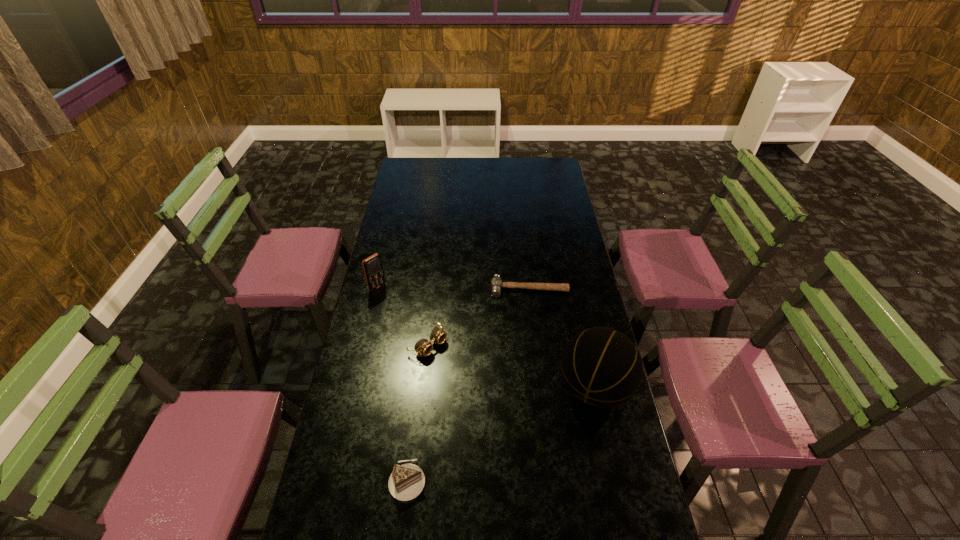
Where is `empty location between the shortest object and the cellular telephone`? The width and height of the screenshot is (960, 540). empty location between the shortest object and the cellular telephone is located at coordinates (453, 288).

Where is `vacant point located between the goggles and the hammer`? This screenshot has height=540, width=960. vacant point located between the goggles and the hammer is located at coordinates (479, 316).

This screenshot has height=540, width=960. Identify the location of free area in between the chocolate cake and the cellular telephone. (393, 384).

At what (x,y) coordinates should I click in order to perform the action: click on unoccupied position between the fourth shortest object and the tallest object. Please return your answer as a coordinate pair (x, y). This screenshot has height=540, width=960. Looking at the image, I should click on (486, 338).

You are a GUI agent. You are given a task and a screenshot of the screen. Output one action in this format:
    pyautogui.click(x=<x>, y=<y>)
    Task: Click on the unoccupied position between the cellular telephone and the hammer
    
    Given the screenshot: What is the action you would take?
    pyautogui.click(x=453, y=288)

Identify the location of empty space that is in between the tallest object and the goggles. (511, 366).

I want to click on free spot between the chocolate cake and the goggles, so click(418, 412).

The width and height of the screenshot is (960, 540). What are the coordinates of `object that can be found as the closest to the chocolate cake` in the screenshot? It's located at (438, 336).

I want to click on object that is the closest to the basketball, so click(x=496, y=283).

This screenshot has width=960, height=540. Find the location of `vacant position in the image that satisfies the following two spatial constraints: 1. on the front side of the second tallest object; 2. on the right side of the tallest object`. vacant position in the image that satisfies the following two spatial constraints: 1. on the front side of the second tallest object; 2. on the right side of the tallest object is located at coordinates (354, 388).